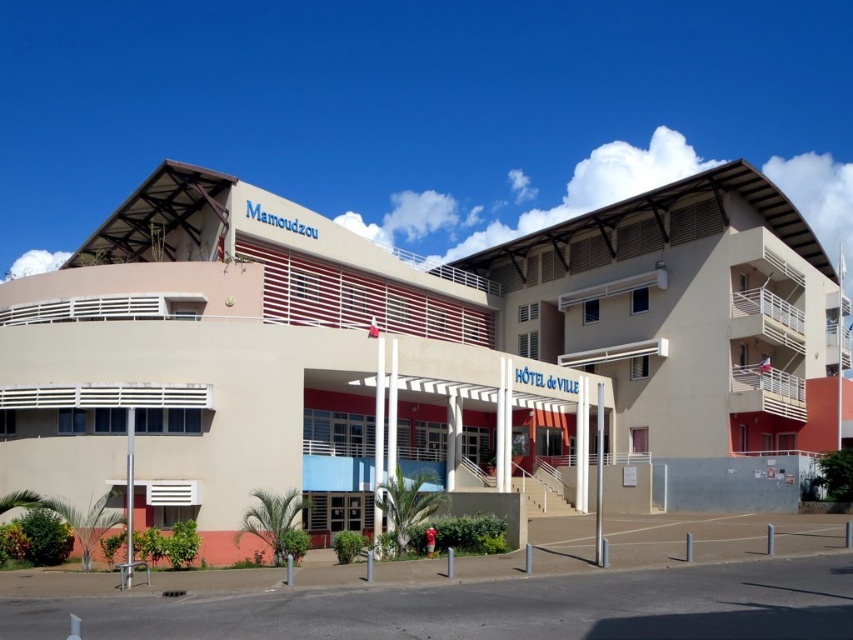
Question: Is beige concrete building at center to the left of beige concrete hotel de ville at center from the viewer's perspective?

Choices:
 (A) yes
 (B) no

Answer: (A)

Question: Among these objects, which one is nearest to the camera?

Choices:
 (A) beige concrete building at center
 (B) beige concrete hotel de ville at center

Answer: (A)

Question: Can you confirm if beige concrete building at center is thinner than beige concrete hotel de ville at center?

Choices:
 (A) no
 (B) yes

Answer: (A)

Question: Which object appears closest to the camera in this image?

Choices:
 (A) beige concrete building at center
 (B) beige concrete hotel de ville at center

Answer: (A)

Question: Does beige concrete building at center lie behind beige concrete hotel de ville at center?

Choices:
 (A) yes
 (B) no

Answer: (B)